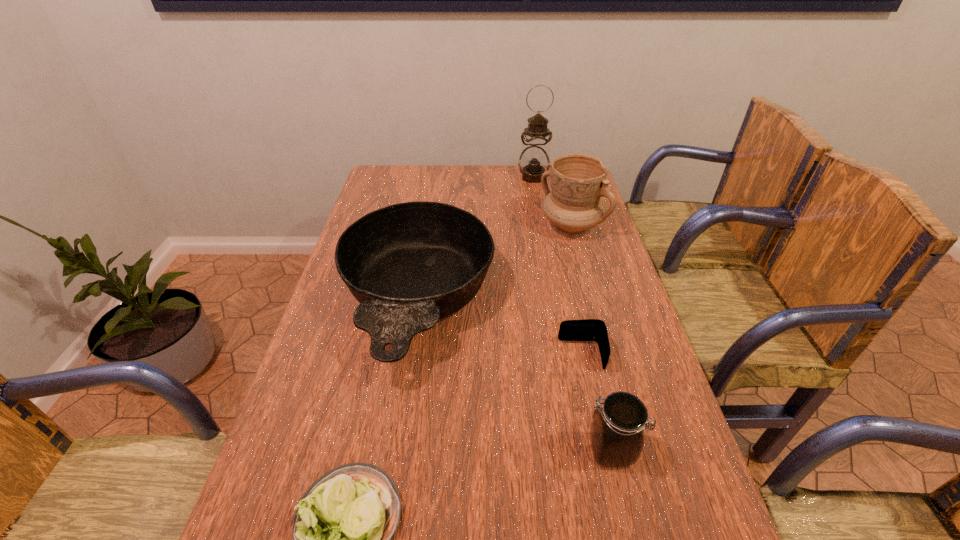
Identify the location of the closest object to the fifth shortest object. (410, 264).

Locate an element on the screen. object that is the third closest one to the wallet is located at coordinates (578, 181).

Find the location of a particular element. vacant region that satisfies the following two spatial constraints: 1. on the front side of the second tallest object; 2. on the lid of the jar is located at coordinates (634, 450).